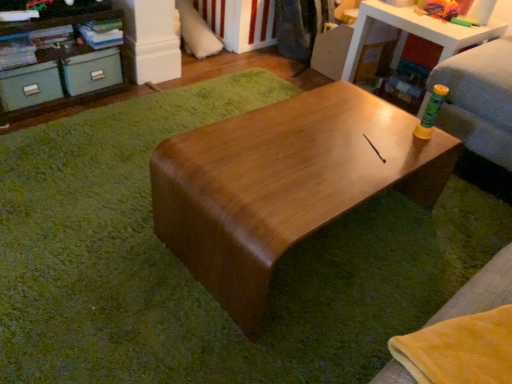
What do you see at coordinates (30, 86) in the screenshot? This screenshot has height=384, width=512. I see `matte green drawer at left, acting as the 2th drawer starting from the right` at bounding box center [30, 86].

Measure the distance between point (79,89) and camera.

The distance of point (79,89) from camera is 1.94 meters.

This screenshot has width=512, height=384. I want to click on matte green drawer at left, the 1th drawer from the right, so click(92, 71).

What is the approximate height of soft yellow fabric couch at lower right?

It is 3.47 inches.

I want to click on matte teal storage boxes at upper left, so click(x=61, y=65).

How many degrees apart are the facing directions of soft yellow fabric couch at lower right and shiny brown table at upper right, acting as the second table starting from the left?

There is a 88.3-degree angle between the facing directions of soft yellow fabric couch at lower right and shiny brown table at upper right, acting as the second table starting from the left.

Looking at the image, does soft yellow fabric couch at lower right seem bigger or smaller compared to shiny brown table at upper right, which appears as the second table when viewed from the front?

Considering their sizes, soft yellow fabric couch at lower right takes up less space than shiny brown table at upper right, which appears as the second table when viewed from the front.

Is soft yellow fabric couch at lower right with shiny brown table at upper right, which is counted as the first table, starting from the back?

No, soft yellow fabric couch at lower right is not making contact with shiny brown table at upper right, which is counted as the first table, starting from the back.

Between soft yellow fabric couch at lower right and shiny brown table at upper right, the second table positioned from the bottom, which one has less height?

soft yellow fabric couch at lower right is shorter.

From the image's perspective, between matte green drawer at left, the 2th drawer in the left-to-right sequence, and soft yellow fabric couch at lower right, which one is located above?

matte green drawer at left, the 2th drawer in the left-to-right sequence, from the image's perspective.

Is matte green drawer at left, the 2th drawer in the left-to-right sequence, at the right side of soft yellow fabric couch at lower right?

No.

Does point (97, 53) come behind point (470, 312)?

That is True.

Is matte green drawer at left, the 2th drawer in the left-to-right sequence, with soft yellow fabric couch at lower right?

There is a gap between matte green drawer at left, the 2th drawer in the left-to-right sequence, and soft yellow fabric couch at lower right.

Is point (10, 108) more distant than point (507, 295)?

Yes, it is.

Considering the relative positions of matte green drawer at left, the first drawer positioned from the left, and soft yellow fabric couch at lower right in the image provided, is matte green drawer at left, the first drawer positioned from the left, to the left of soft yellow fabric couch at lower right from the viewer's perspective?

Correct, you'll find matte green drawer at left, the first drawer positioned from the left, to the left of soft yellow fabric couch at lower right.

Considering the sizes of objects matte green drawer at left, the first drawer positioned from the left, and soft yellow fabric couch at lower right in the image provided, who is wider, matte green drawer at left, the first drawer positioned from the left, or soft yellow fabric couch at lower right?

matte green drawer at left, the first drawer positioned from the left.

Considering the positions of objects matte green drawer at left, the first drawer positioned from the left, and soft yellow fabric couch at lower right in the image provided, who is behind, matte green drawer at left, the first drawer positioned from the left, or soft yellow fabric couch at lower right?

matte green drawer at left, the first drawer positioned from the left, is behind.

Between soft yellow fabric couch at lower right and matte green drawer at left, acting as the 2th drawer starting from the right, which one has larger width?

matte green drawer at left, acting as the 2th drawer starting from the right.

Is soft yellow fabric couch at lower right inside the boundaries of matte green drawer at left, acting as the 2th drawer starting from the right, or outside?

soft yellow fabric couch at lower right lies outside matte green drawer at left, acting as the 2th drawer starting from the right.

From a real-world perspective, is soft yellow fabric couch at lower right positioned over matte green drawer at left, the first drawer positioned from the left, based on gravity?

Yes, from a real-world perspective, soft yellow fabric couch at lower right is on top of matte green drawer at left, the first drawer positioned from the left.

Is soft yellow fabric couch at lower right not near matte green drawer at left, the first drawer positioned from the left?

soft yellow fabric couch at lower right is far away from matte green drawer at left, the first drawer positioned from the left.

Could you tell me if matte green drawer at left, acting as the 2th drawer starting from the right, is facing shiny brown table at center, the 1th table when ordered from left to right?

Yes, matte green drawer at left, acting as the 2th drawer starting from the right, faces towards shiny brown table at center, the 1th table when ordered from left to right.

From a real-world perspective, which is physically below, matte green drawer at left, acting as the 2th drawer starting from the right, or shiny brown table at center, the 1th table when ordered from left to right?

matte green drawer at left, acting as the 2th drawer starting from the right.

From the image's perspective, is matte green drawer at left, the first drawer positioned from the left, under shiny brown table at center, placed as the 2th table when sorted from back to front?

No.

Looking at this image, is matte green drawer at left, the first drawer positioned from the left, situated inside shiny brown table at center, the 1th table when ordered from left to right, or outside?

matte green drawer at left, the first drawer positioned from the left, is not inside shiny brown table at center, the 1th table when ordered from left to right, it's outside.

From a real-world perspective, between matte green drawer at left, the 1th drawer from the right, and shiny brown table at center, the first table from the front, who is vertically lower?

In real-world perspective, matte green drawer at left, the 1th drawer from the right, is lower.

Is matte green drawer at left, the 1th drawer from the right, wider or thinner than shiny brown table at center, placed as the 2th table when sorted from back to front?

matte green drawer at left, the 1th drawer from the right, is thinner than shiny brown table at center, placed as the 2th table when sorted from back to front.

From a real-world perspective, count 1st tables upward from the matte green drawer at left, the 1th drawer from the right, and point to it. Please provide its 2D coordinates.

[(284, 184)]

Can you confirm if matte teal storage boxes at upper left is bigger than shiny brown table at center, placed as the 2th table when sorted from back to front?

No.

Looking at this image, what's the angular difference between matte teal storage boxes at upper left and shiny brown table at center, the 1th table when ordered from left to right,'s facing directions?

178 degrees separate the facing orientations of matte teal storage boxes at upper left and shiny brown table at center, the 1th table when ordered from left to right.

Does matte teal storage boxes at upper left lie behind shiny brown table at center, the 2th table positioned from the right?

That is True.

Measure the distance between matte teal storage boxes at upper left and shiny brown table at center, placed as the 2th table when sorted from back to front.

matte teal storage boxes at upper left and shiny brown table at center, placed as the 2th table when sorted from back to front, are 3.59 feet apart from each other.

Find the location of a particular element. This screenshot has width=512, height=384. couch in front of the shiny brown table at upper right, the second table positioned from the bottom is located at coordinates (482, 288).

Where is `couch on the right of the matte green drawer at left, the 2th drawer in the left-to-right sequence`? This screenshot has width=512, height=384. couch on the right of the matte green drawer at left, the 2th drawer in the left-to-right sequence is located at coordinates (482, 288).

When comparing their distances from shiny brown table at upper right, acting as the second table starting from the left, does matte green drawer at left, the first drawer positioned from the left, or soft yellow fabric couch at lower right seem closer?

soft yellow fabric couch at lower right is positioned closer to the anchor shiny brown table at upper right, acting as the second table starting from the left.

Looking at the image, which one is located closer to matte teal storage boxes at upper left, matte green drawer at left, the first drawer positioned from the left, or soft yellow fabric couch at lower right?

Based on the image, matte green drawer at left, the first drawer positioned from the left, appears to be nearer to matte teal storage boxes at upper left.

Which object lies further to the anchor point shiny brown table at upper right, positioned as the 1th table in top-to-bottom order, matte teal storage boxes at upper left or matte green drawer at left, the 1th drawer from the right?

matte teal storage boxes at upper left.

Estimate the real-world distances between objects in this image. Which object is further from matte green drawer at left, the 2th drawer in the left-to-right sequence, shiny brown table at center, the 2th table positioned from the right, or shiny brown table at upper right, which is counted as the first table, starting from the back?

shiny brown table at upper right, which is counted as the first table, starting from the back, is further to matte green drawer at left, the 2th drawer in the left-to-right sequence.

When comparing their distances from matte teal storage boxes at upper left, does soft yellow fabric couch at lower right or matte green drawer at left, the first drawer positioned from the left, seem closer?

matte green drawer at left, the first drawer positioned from the left.

Estimate the real-world distances between objects in this image. Which object is closer to matte teal storage boxes at upper left, shiny brown table at upper right, positioned as the 1th table in top-to-bottom order, or shiny brown table at center, the 1th table when ordered from left to right?

shiny brown table at center, the 1th table when ordered from left to right, is closer to matte teal storage boxes at upper left.

Considering their positions, is shiny brown table at center, the 2th table positioned from the top, positioned closer to matte teal storage boxes at upper left than soft yellow fabric couch at lower right?

Among the two, shiny brown table at center, the 2th table positioned from the top, is located nearer to matte teal storage boxes at upper left.

Looking at the image, which one is located closer to matte teal storage boxes at upper left, shiny brown table at center, the 2th table positioned from the right, or matte green drawer at left, acting as the 2th drawer starting from the right?

matte green drawer at left, acting as the 2th drawer starting from the right, is positioned closer to the anchor matte teal storage boxes at upper left.

Find the location of a particular element. table between matte green drawer at left, the 1th drawer from the right, and shiny brown table at upper right, positioned as the 1th table in top-to-bottom order, in the horizontal direction is located at coordinates (284, 184).

You are a GUI agent. You are given a task and a screenshot of the screen. Output one action in this format:
    pyautogui.click(x=<x>, y=<y>)
    Task: Click on the drawer situated between matte green drawer at left, the first drawer positioned from the left, and soft yellow fabric couch at lower right from left to right
    
    Given the screenshot: What is the action you would take?
    pyautogui.click(x=92, y=71)

The image size is (512, 384). Find the location of `shelf between matte green drawer at left, acting as the 2th drawer starting from the right, and soft yellow fabric couch at lower right from left to right`. shelf between matte green drawer at left, acting as the 2th drawer starting from the right, and soft yellow fabric couch at lower right from left to right is located at coordinates (61, 65).

Where is `drawer between matte teal storage boxes at upper left and matte green drawer at left, the 2th drawer in the left-to-right sequence, along the z-axis`? drawer between matte teal storage boxes at upper left and matte green drawer at left, the 2th drawer in the left-to-right sequence, along the z-axis is located at coordinates (30, 86).